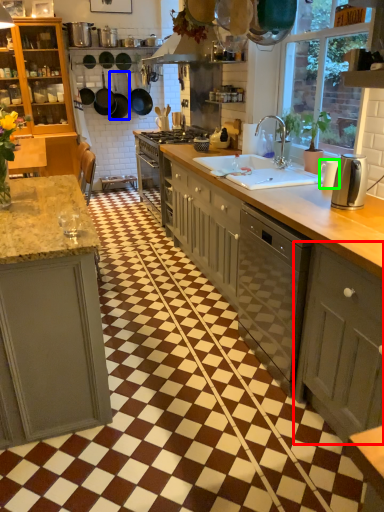
Question: Which object is positioned farthest from cabinetry (highlighted by a red box)? Select from frying pan (highlighted by a blue box) and appliance (highlighted by a green box).

Choices:
 (A) frying pan
 (B) appliance

Answer: (A)